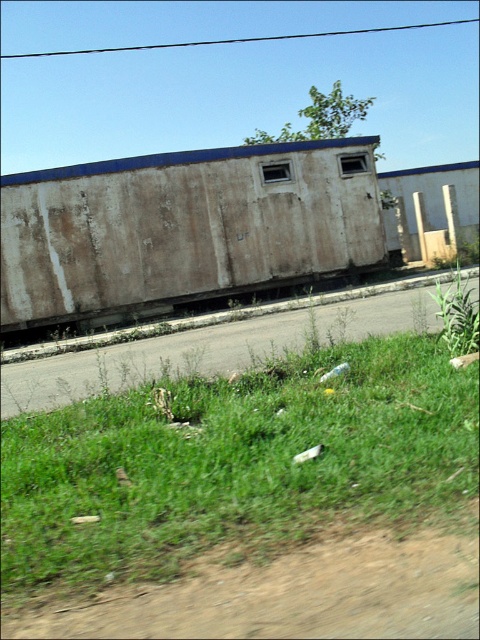
You are standing on the paved road next to the train tracks. You see the green grass at lower left and the rusty metal train car at center. Which one is wider in width?

The green grass at lower left might be wider than rusty metal train car at center according to the description.

You are standing on the paved road in front of the rusty metal train car at center. If you walk directly towards the train car, will you reach it before reaching the point at coordinate 0.359, 0.383?

Yes, because the rusty metal train car at center is located exactly at the point [183,228], so walking directly towards it means you will reach it precisely at that coordinate.

Based on the photo, you are standing on the paved road in front of the abandoned train car. You notice two patches of green grass at lower left and green grass at lower right. Which patch of grass is positioned to the left when facing the train car?

The green grass at lower left is positioned to the left of the green grass at lower right when facing the train car.